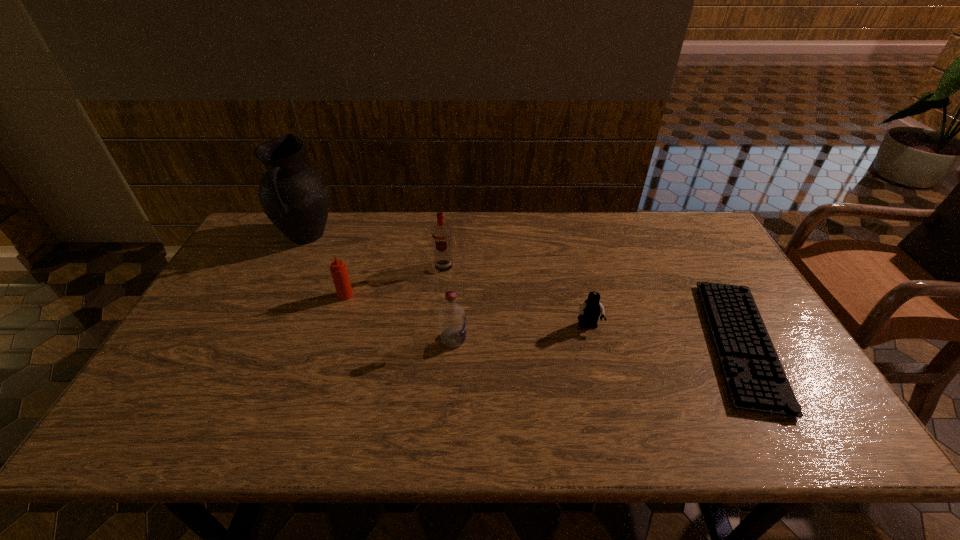
I want to click on object that is at the far left corner, so click(294, 196).

Where is `object located at the near right corner`? object located at the near right corner is located at coordinates (756, 381).

In the image, there is a desktop. At what (x,y) coordinates should I click in order to perform the action: click on vacant area at the far edge. Please return your answer as a coordinate pair (x, y). Image resolution: width=960 pixels, height=540 pixels. Looking at the image, I should click on (525, 228).

In the image, there is a desktop. What are the coordinates of `free space at the near edge` in the screenshot? It's located at (754, 415).

Locate an element on the screen. The height and width of the screenshot is (540, 960). vacant space at the left edge of the desktop is located at coordinates (258, 296).

Locate an element on the screen. Image resolution: width=960 pixels, height=540 pixels. vacant point at the far right corner is located at coordinates (657, 220).

In order to click on unoccupied position between the rightmost object and the leftmost object in this screenshot , I will do `click(523, 290)`.

This screenshot has width=960, height=540. Identify the location of free space that is in between the fifth object from right to left and the shortest object. (542, 320).

Where is `vacant space that is in between the shortest object and the Tabasco sauce`? This screenshot has height=540, width=960. vacant space that is in between the shortest object and the Tabasco sauce is located at coordinates (542, 320).

Where is `vacant space in between the second object from right to left and the pitcher`? This screenshot has height=540, width=960. vacant space in between the second object from right to left and the pitcher is located at coordinates (447, 281).